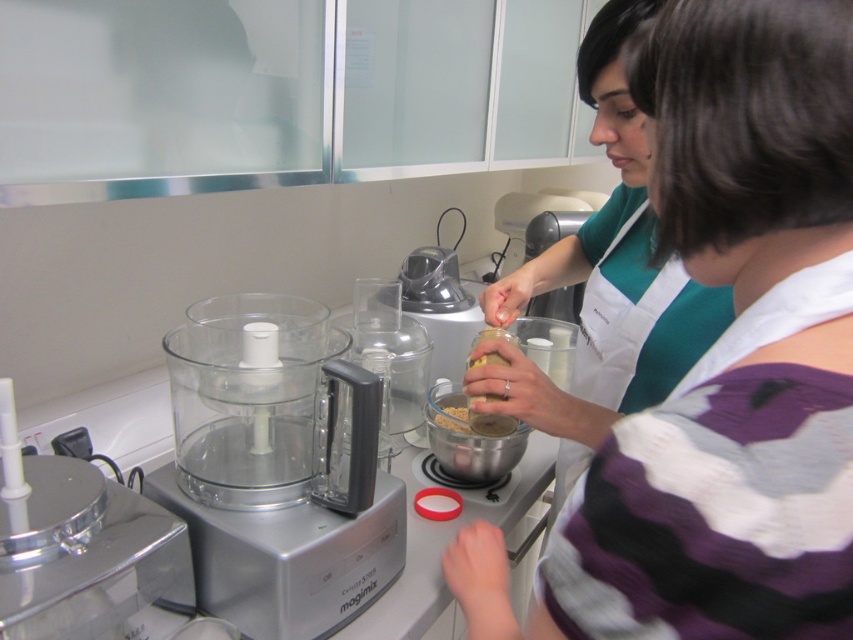
How much distance is there between brushed metal food processor at left and brown matte jar at center?

brushed metal food processor at left and brown matte jar at center are 24.38 inches apart from each other.

Who is higher up, brushed metal food processor at left or brown matte jar at center?

Positioned higher is brown matte jar at center.

Describe the element at coordinates (74, 545) in the screenshot. I see `brushed metal food processor at left` at that location.

Locate an element on the screen. The image size is (853, 640). brushed metal food processor at left is located at coordinates (74, 545).

Who is positioned more to the left, transparent plastic blender at center or sandy brown plastic jar at center?

transparent plastic blender at center is more to the left.

Is point (401, 372) more distant than point (480, 428)?

Yes.

You are a GUI agent. You are given a task and a screenshot of the screen. Output one action in this format:
    pyautogui.click(x=<x>, y=<y>)
    Task: Click on the transparent plastic blender at center
    The height and width of the screenshot is (640, 853).
    Given the screenshot: What is the action you would take?
    pyautogui.click(x=392, y=349)

Is point (540, 570) less distant than point (445, 426)?

Yes.

Is the position of white apron at center less distant than that of brown matte jar at center?

Yes, white apron at center is in front of brown matte jar at center.

The image size is (853, 640). In order to click on white apron at center in this screenshot , I will do `click(724, 362)`.